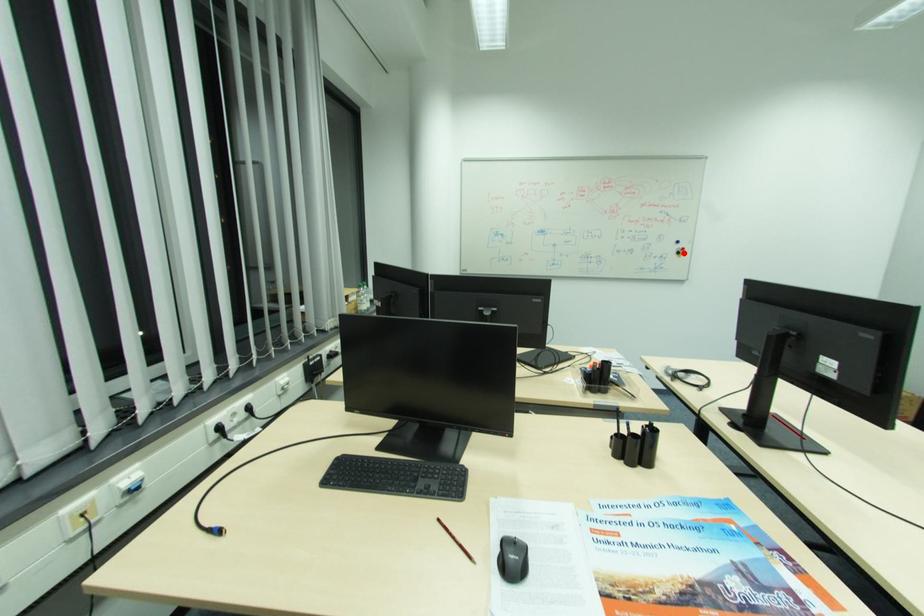
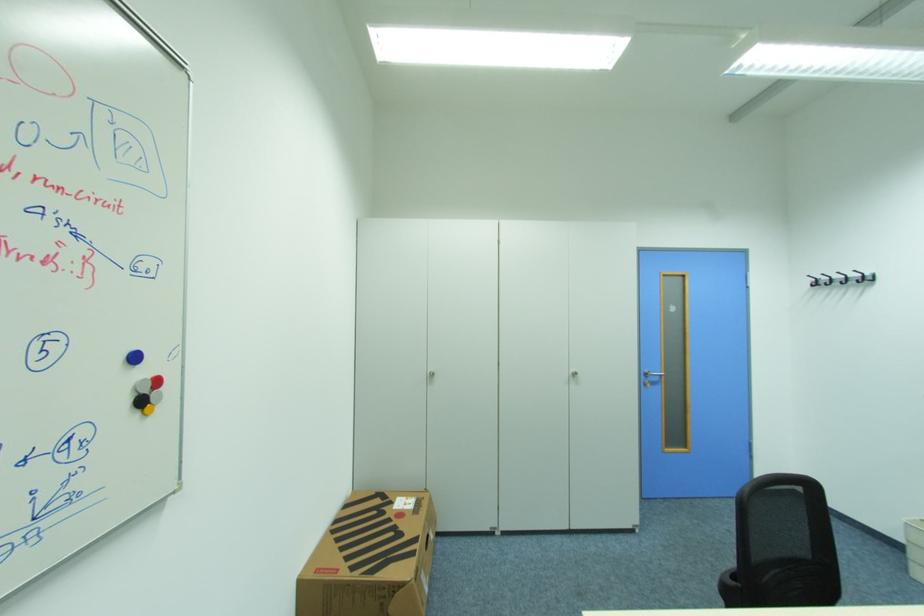
The point at the highlighted location is marked in the first image. Where is the corresponding point in the second image?

(146, 403)